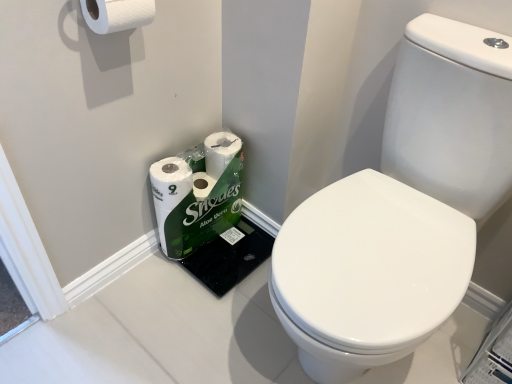
What is the approximate width of white glossy toilet at center?

The width of white glossy toilet at center is 24.86 inches.

I want to click on white glossy toilet paper at lower left, the second toilet paper in the front-to-back sequence, so click(197, 193).

From the picture: Considering the sizes of objects white matte toilet paper at upper left, marked as the 2th toilet paper in a back-to-front arrangement, and white glossy toilet paper at lower left, marked as the 2th toilet paper in a top-to-bottom arrangement, in the image provided, who is bigger, white matte toilet paper at upper left, marked as the 2th toilet paper in a back-to-front arrangement, or white glossy toilet paper at lower left, marked as the 2th toilet paper in a top-to-bottom arrangement,?

white glossy toilet paper at lower left, marked as the 2th toilet paper in a top-to-bottom arrangement, is bigger.

From a real-world perspective, is white matte toilet paper at upper left, the first toilet paper viewed from the top, positioned above or below white glossy toilet paper at lower left, the first toilet paper from the back?

Clearly, from a real-world perspective, white matte toilet paper at upper left, the first toilet paper viewed from the top, is above white glossy toilet paper at lower left, the first toilet paper from the back.

Which is correct: white matte toilet paper at upper left, the first toilet paper viewed from the top, is inside white glossy toilet paper at lower left, acting as the first toilet paper starting from the bottom, or outside of it?

white matte toilet paper at upper left, the first toilet paper viewed from the top, exists outside the volume of white glossy toilet paper at lower left, acting as the first toilet paper starting from the bottom.

Can you confirm if white matte toilet paper at upper left, the first toilet paper from the front, is thinner than white glossy toilet paper at lower left, the second toilet paper in the front-to-back sequence?

Yes.

From the image's perspective, is white matte toilet paper at upper left, the second toilet paper when ordered from bottom to top, located above or below white glossy toilet at center?

white matte toilet paper at upper left, the second toilet paper when ordered from bottom to top, is above white glossy toilet at center.

Considering the positions of objects white matte toilet paper at upper left, the second toilet paper when ordered from bottom to top, and white glossy toilet at center in the image provided, who is more to the right, white matte toilet paper at upper left, the second toilet paper when ordered from bottom to top, or white glossy toilet at center?

Positioned to the right is white glossy toilet at center.

Considering the sizes of objects white matte toilet paper at upper left, marked as the 2th toilet paper in a back-to-front arrangement, and white glossy toilet at center in the image provided, who is taller, white matte toilet paper at upper left, marked as the 2th toilet paper in a back-to-front arrangement, or white glossy toilet at center?

white glossy toilet at center.

Find the location of a particular element. toilet below the white matte toilet paper at upper left, the first toilet paper viewed from the top (from the image's perspective) is located at coordinates (402, 209).

Between white glossy toilet at center and white glossy toilet paper at lower left, acting as the first toilet paper starting from the bottom, which one has larger size?

With larger size is white glossy toilet at center.

Is white glossy toilet at center placed right next to white glossy toilet paper at lower left, the first toilet paper from the back?

No, white glossy toilet at center is not with white glossy toilet paper at lower left, the first toilet paper from the back.

Consider the image. Which of these two, white glossy toilet at center or white glossy toilet paper at lower left, marked as the 2th toilet paper in a top-to-bottom arrangement, stands taller?

With more height is white glossy toilet at center.

Locate an element on the screen. This screenshot has height=384, width=512. toilet that is in front of the white glossy toilet paper at lower left, the first toilet paper from the back is located at coordinates (402, 209).

From the image's perspective, which one is positioned lower, white glossy toilet at center or white matte toilet paper at upper left, the first toilet paper from the front?

white glossy toilet at center appears lower in the image.

Is white glossy toilet at center bigger than white matte toilet paper at upper left, the first toilet paper viewed from the top?

Yes.

Is white glossy toilet at center closer to camera compared to white matte toilet paper at upper left, the first toilet paper viewed from the top?

That is True.

Is white glossy toilet at center aimed at white matte toilet paper at upper left, marked as the 2th toilet paper in a back-to-front arrangement?

No, white glossy toilet at center is not oriented towards white matte toilet paper at upper left, marked as the 2th toilet paper in a back-to-front arrangement.

Would you say white glossy toilet paper at lower left, marked as the 2th toilet paper in a top-to-bottom arrangement, is to the left or to the right of white glossy toilet at center in the picture?

Clearly, white glossy toilet paper at lower left, marked as the 2th toilet paper in a top-to-bottom arrangement, is on the left of white glossy toilet at center in the image.

The height and width of the screenshot is (384, 512). I want to click on the 1st toilet paper to the left of the white glossy toilet at center, starting your count from the anchor, so click(x=197, y=193).

Could you tell me if white glossy toilet paper at lower left, the first toilet paper from the back, is facing white glossy toilet at center?

Yes, white glossy toilet paper at lower left, the first toilet paper from the back, is turned towards white glossy toilet at center.

In the image, is white glossy toilet paper at lower left, the first toilet paper from the back, positioned in front of or behind white glossy toilet at center?

In the image, white glossy toilet paper at lower left, the first toilet paper from the back, appears behind white glossy toilet at center.

Can you confirm if white glossy toilet paper at lower left, the second toilet paper in the front-to-back sequence, is positioned to the right of white matte toilet paper at upper left, the first toilet paper viewed from the top?

Correct, you'll find white glossy toilet paper at lower left, the second toilet paper in the front-to-back sequence, to the right of white matte toilet paper at upper left, the first toilet paper viewed from the top.

From the image's perspective, does white glossy toilet paper at lower left, marked as the 2th toilet paper in a top-to-bottom arrangement, appear lower than white matte toilet paper at upper left, the second toilet paper when ordered from bottom to top?

Indeed, from the image's perspective, white glossy toilet paper at lower left, marked as the 2th toilet paper in a top-to-bottom arrangement, is shown beneath white matte toilet paper at upper left, the second toilet paper when ordered from bottom to top.

Is white glossy toilet paper at lower left, the first toilet paper from the back, turned away from white matte toilet paper at upper left, the second toilet paper when ordered from bottom to top?

No, white matte toilet paper at upper left, the second toilet paper when ordered from bottom to top, is not at the back of white glossy toilet paper at lower left, the first toilet paper from the back.

Between white glossy toilet paper at lower left, the first toilet paper from the back, and white matte toilet paper at upper left, the second toilet paper when ordered from bottom to top, which one is positioned in front?

white matte toilet paper at upper left, the second toilet paper when ordered from bottom to top, is closer to the camera.

This screenshot has width=512, height=384. In order to click on toilet paper that is on the left side of white glossy toilet paper at lower left, the first toilet paper from the back in this screenshot , I will do `click(117, 14)`.

Find the location of a particular element. This screenshot has height=384, width=512. toilet below the white matte toilet paper at upper left, the second toilet paper when ordered from bottom to top (from the image's perspective) is located at coordinates (402, 209).

Based on their spatial positions, is white glossy toilet at center or white glossy toilet paper at lower left, acting as the first toilet paper starting from the bottom, closer to white matte toilet paper at upper left, the second toilet paper when ordered from bottom to top?

white glossy toilet paper at lower left, acting as the first toilet paper starting from the bottom, is closer to white matte toilet paper at upper left, the second toilet paper when ordered from bottom to top.

Based on their spatial positions, is white matte toilet paper at upper left, the first toilet paper from the front, or white glossy toilet paper at lower left, acting as the first toilet paper starting from the bottom, closer to white glossy toilet at center?

white glossy toilet paper at lower left, acting as the first toilet paper starting from the bottom, is closer to white glossy toilet at center.

From the image, which object appears to be farther from white glossy toilet at center, white glossy toilet paper at lower left, acting as the first toilet paper starting from the bottom, or white matte toilet paper at upper left, the first toilet paper from the front?

white matte toilet paper at upper left, the first toilet paper from the front, lies further to white glossy toilet at center than the other object.

Based on their spatial positions, is white matte toilet paper at upper left, the first toilet paper from the front, or white glossy toilet at center closer to white glossy toilet paper at lower left, acting as the first toilet paper starting from the bottom?

white glossy toilet at center.

Looking at the image, which one is located further to white glossy toilet paper at lower left, the first toilet paper from the back, white glossy toilet at center or white matte toilet paper at upper left, the first toilet paper from the front?

white matte toilet paper at upper left, the first toilet paper from the front.

From the image, which object appears to be nearer to white matte toilet paper at upper left, the first toilet paper viewed from the top, white glossy toilet paper at lower left, the second toilet paper in the front-to-back sequence, or white glossy toilet at center?

white glossy toilet paper at lower left, the second toilet paper in the front-to-back sequence, is positioned closer to the anchor white matte toilet paper at upper left, the first toilet paper viewed from the top.

At what (x,y) coordinates should I click in order to perform the action: click on toilet paper located between white glossy toilet at center and white glossy toilet paper at lower left, marked as the 2th toilet paper in a top-to-bottom arrangement, in the depth direction. Please return your answer as a coordinate pair (x, y). The width and height of the screenshot is (512, 384). Looking at the image, I should click on (117, 14).